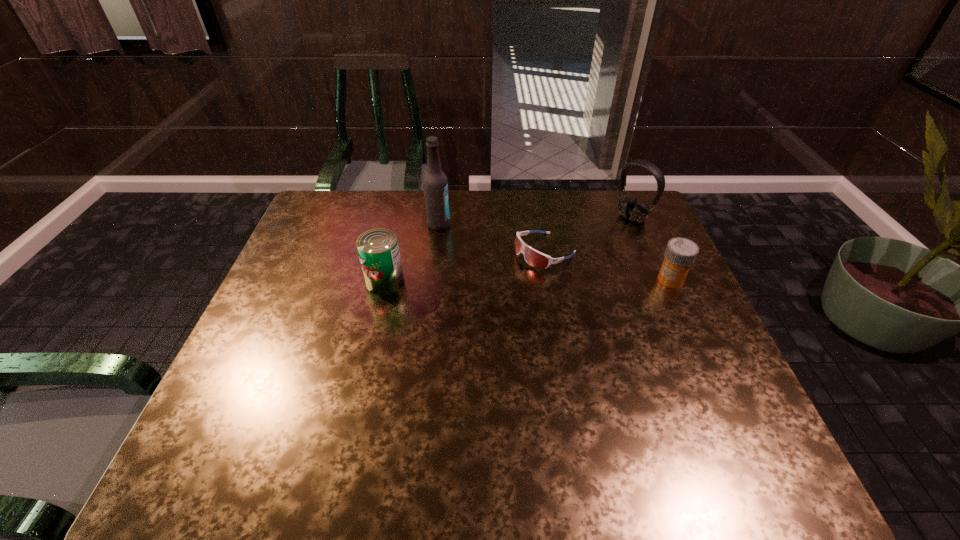
This screenshot has height=540, width=960. I want to click on vacant region located on the label side of the medicine, so click(541, 279).

Locate an element on the screen. The height and width of the screenshot is (540, 960). vacant space located on the label side of the medicine is located at coordinates (567, 279).

Where is `vacant region located 0.170m on the front-facing side of the second tallest object`? vacant region located 0.170m on the front-facing side of the second tallest object is located at coordinates (588, 248).

Identify the location of free space located 0.240m on the front-facing side of the second tallest object. This screenshot has height=540, width=960. (573, 258).

Identify the location of vacant space located on the front-facing side of the second tallest object. (611, 233).

This screenshot has width=960, height=540. I want to click on vacant space positioned on the front-facing side of the shortest object, so click(x=422, y=313).

I want to click on free space located on the front-facing side of the shortest object, so click(470, 289).

You are a GUI agent. You are given a task and a screenshot of the screen. Output one action in this format:
    pyautogui.click(x=<x>, y=<y>)
    Task: Click on the vacant area situated on the front-facing side of the shortest object
    This screenshot has height=540, width=960.
    Given the screenshot: What is the action you would take?
    pyautogui.click(x=485, y=281)

Locate an element on the screen. This screenshot has height=540, width=960. free space located on the label of the fourth object from right to left is located at coordinates (540, 271).

Locate an element on the screen. vacant space located on the label of the fourth object from right to left is located at coordinates (550, 275).